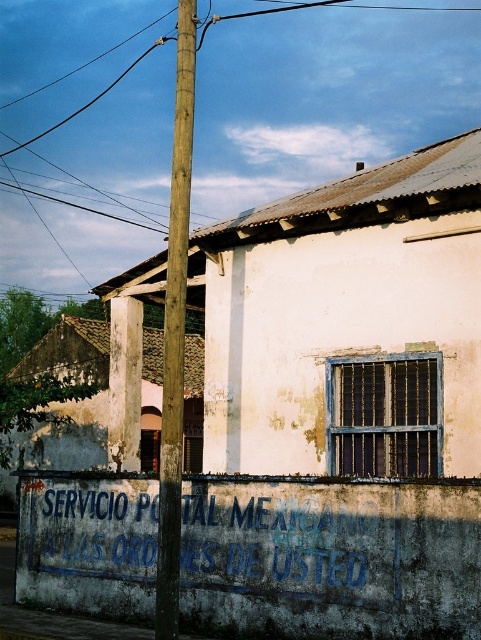
Question: Can you confirm if blue faded graffiti at lower center is bigger than wooden telegraph pole at center?

Choices:
 (A) no
 (B) yes

Answer: (A)

Question: Which point is farther to the camera?

Choices:
 (A) wooden telegraph pole at center
 (B) blue faded graffiti at lower center

Answer: (B)

Question: Can you confirm if blue faded graffiti at lower center is positioned above wooden telegraph pole at center?

Choices:
 (A) no
 (B) yes

Answer: (A)

Question: Does blue faded graffiti at lower center have a larger size compared to wooden telegraph pole at center?

Choices:
 (A) no
 (B) yes

Answer: (A)